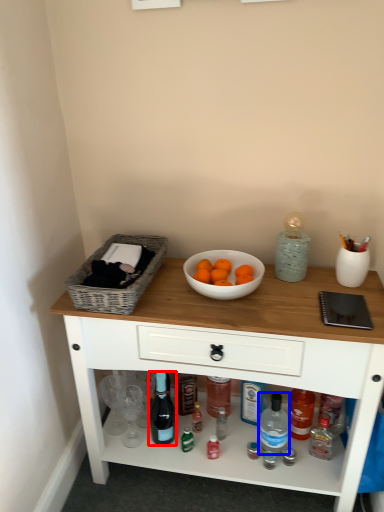
Question: Which object appears farthest to the camera in this image, bottle (highlighted by a red box) or bottle (highlighted by a blue box)?

Choices:
 (A) bottle
 (B) bottle

Answer: (B)